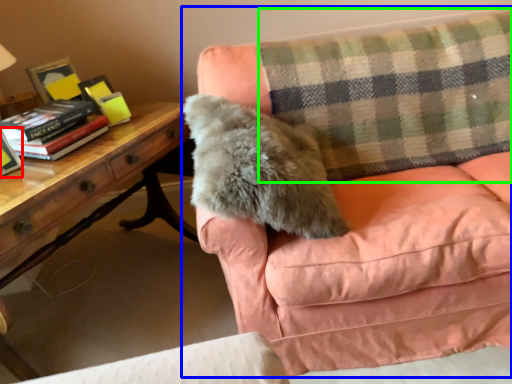
Question: Considering the real-world distances, which object is closest to paperback book (highlighted by a red box)? studio couch (highlighted by a blue box) or plaid (highlighted by a green box).

Choices:
 (A) studio couch
 (B) plaid

Answer: (A)